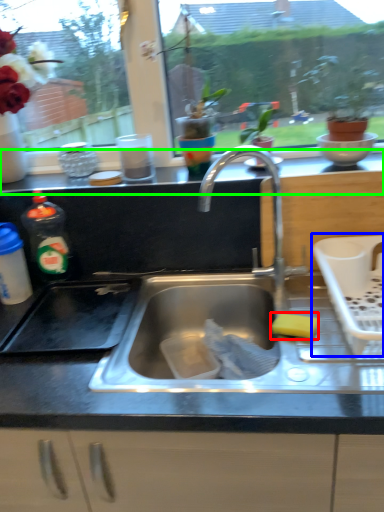
Question: Which is farther away from food (highlighted by a red box)? appliance (highlighted by a blue box) or counter top (highlighted by a green box)?

Choices:
 (A) appliance
 (B) counter top

Answer: (B)